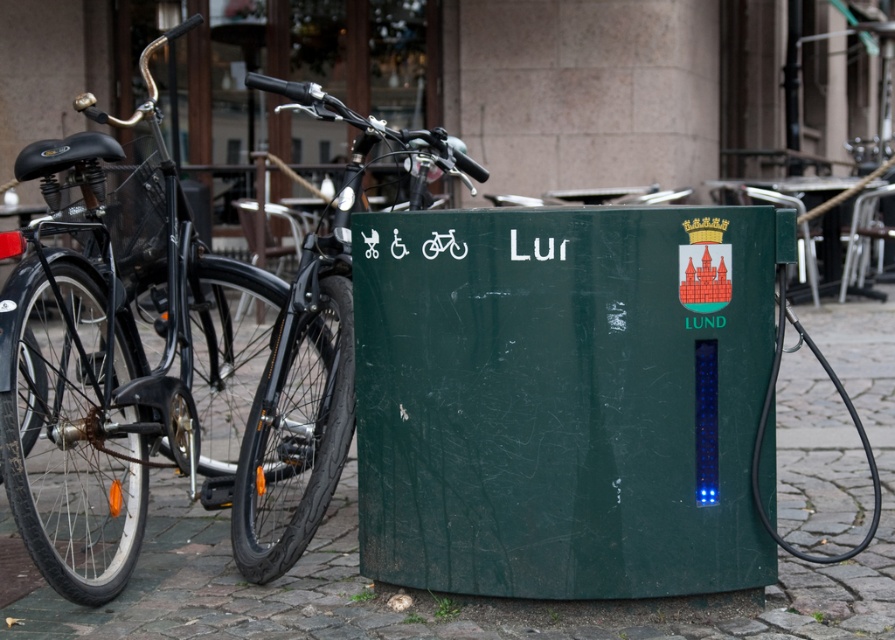
Question: Which point is closer to the camera?

Choices:
 (A) (602, 557)
 (B) (245, 570)

Answer: (A)

Question: Can you confirm if green matte pavement at center is positioned to the right of shiny black bicycle at center?

Choices:
 (A) no
 (B) yes

Answer: (A)

Question: Which of the following is the closest to the observer?

Choices:
 (A) black matte bicycle at left
 (B) green matte pavement at center

Answer: (A)

Question: Does black matte bicycle at left lie in front of shiny black bicycle at center?

Choices:
 (A) yes
 (B) no

Answer: (A)

Question: Is green matte pavement at center above shiny black bicycle at center?

Choices:
 (A) no
 (B) yes

Answer: (A)

Question: Which of these objects is positioned closest to the green matte pavement at center?

Choices:
 (A) black matte bicycle at left
 (B) shiny black bicycle at center

Answer: (B)